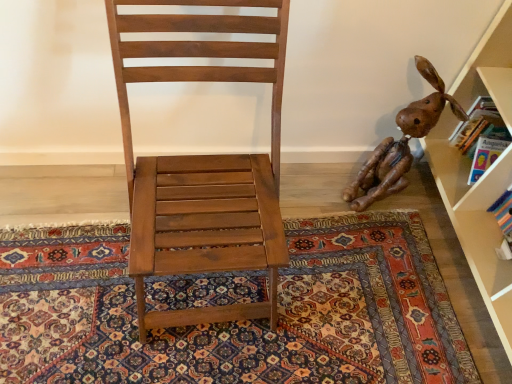
You are a GUI agent. You are given a task and a screenshot of the screen. Output one action in this format:
    pyautogui.click(x=<x>, y=<y>)
    Task: Click on the vacant area situated below brown leather dog at right (from a real-world perspective)
    Image resolution: width=512 pixels, height=384 pixels.
    Given the screenshot: What is the action you would take?
    pyautogui.click(x=378, y=203)